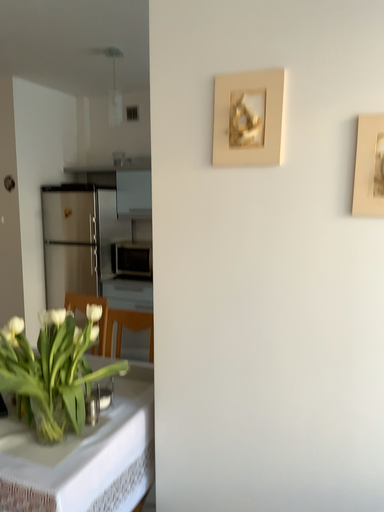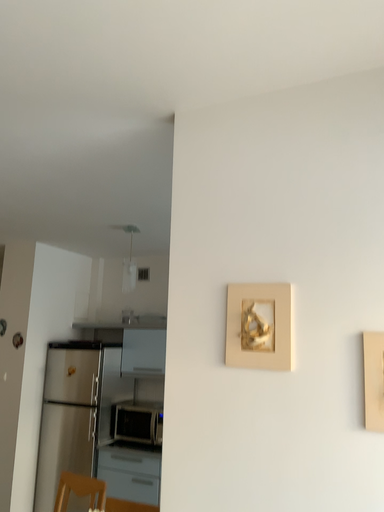
Question: How did the camera likely rotate when shooting the video?

Choices:
 (A) rotated downward
 (B) rotated upward

Answer: (B)